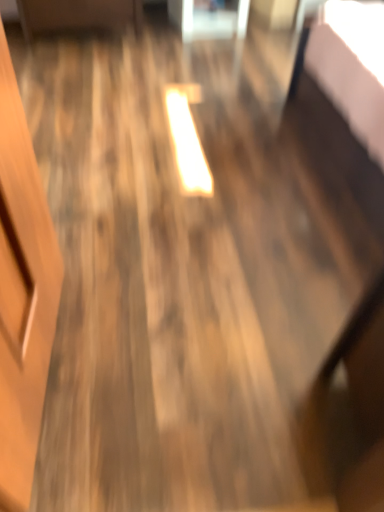
The width and height of the screenshot is (384, 512). What are the coordinates of `wooden door at left` in the screenshot? It's located at (22, 293).

Image resolution: width=384 pixels, height=512 pixels. What do you see at coordinates (22, 293) in the screenshot? I see `wooden door at left` at bounding box center [22, 293].

You are a GUI agent. You are given a task and a screenshot of the screen. Output one action in this format:
    pyautogui.click(x=<x>, y=<y>)
    Task: Click on the wooden door at left
    The image size is (384, 512).
    Given the screenshot: What is the action you would take?
    pyautogui.click(x=22, y=293)